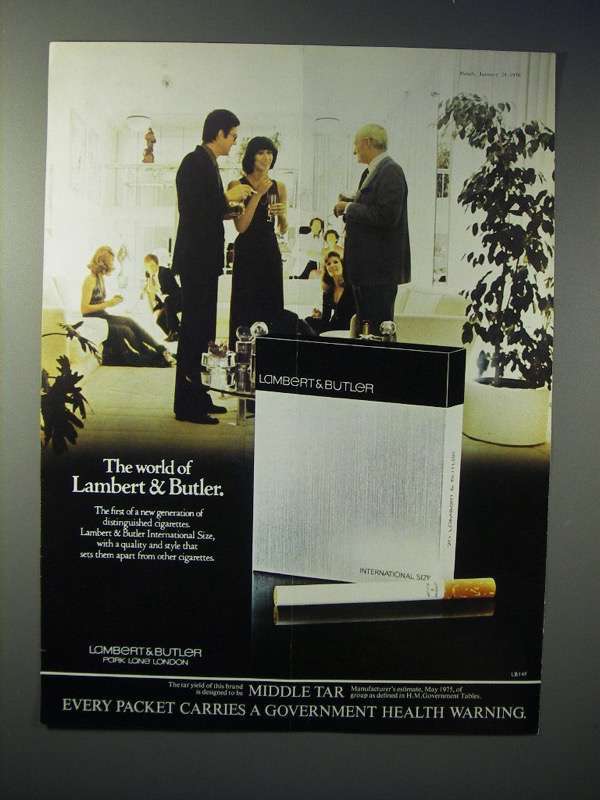
Locate an element on the screen. The image size is (600, 800). picture border is located at coordinates (585, 466), (13, 516), (286, 760), (300, 20).